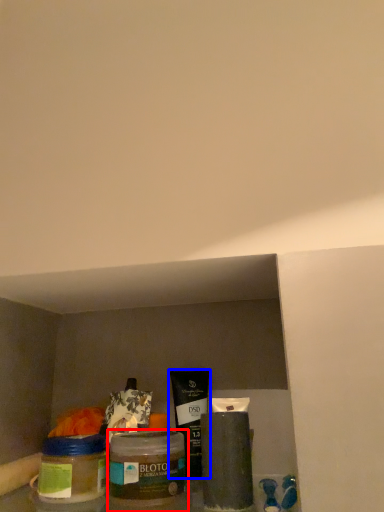
Question: Which object appears farthest to the camera in this image, glass jar (highlighted by a red box) or product (highlighted by a blue box)?

Choices:
 (A) glass jar
 (B) product

Answer: (B)